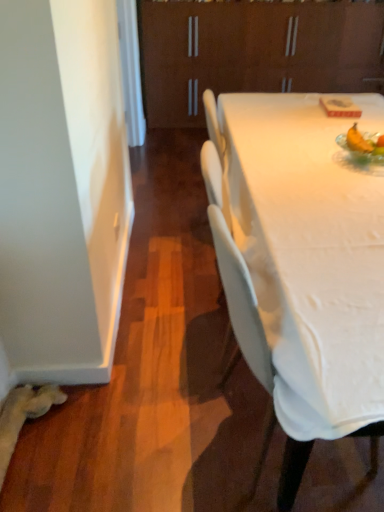
At what (x,y) coordinates should I click in order to perform the action: click on vacant space behind translucent glass bowl at upper right. Please return your answer as a coordinate pair (x, y). The image size is (384, 512). Looking at the image, I should click on (324, 142).